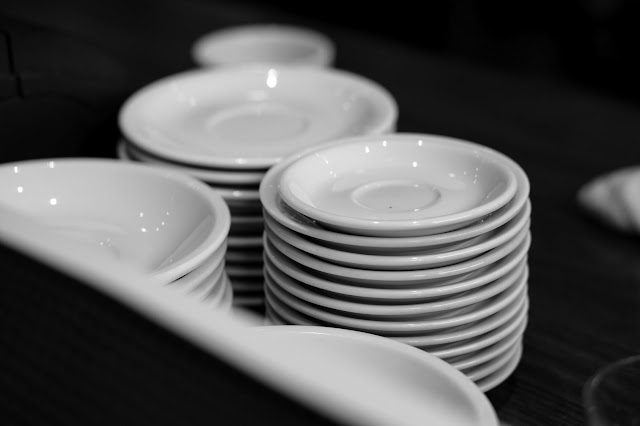
Locate an element on the screen. This screenshot has width=640, height=426. saucer bowls is located at coordinates (195, 259), (202, 271), (211, 287), (216, 296), (228, 304).